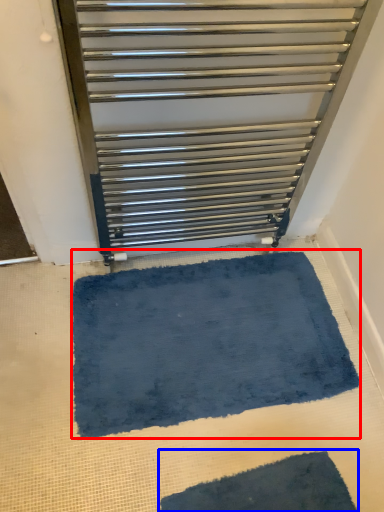
Question: Which object is further to the camera taking this photo, bath mat (highlighted by a red box) or bath mat (highlighted by a blue box)?

Choices:
 (A) bath mat
 (B) bath mat

Answer: (A)